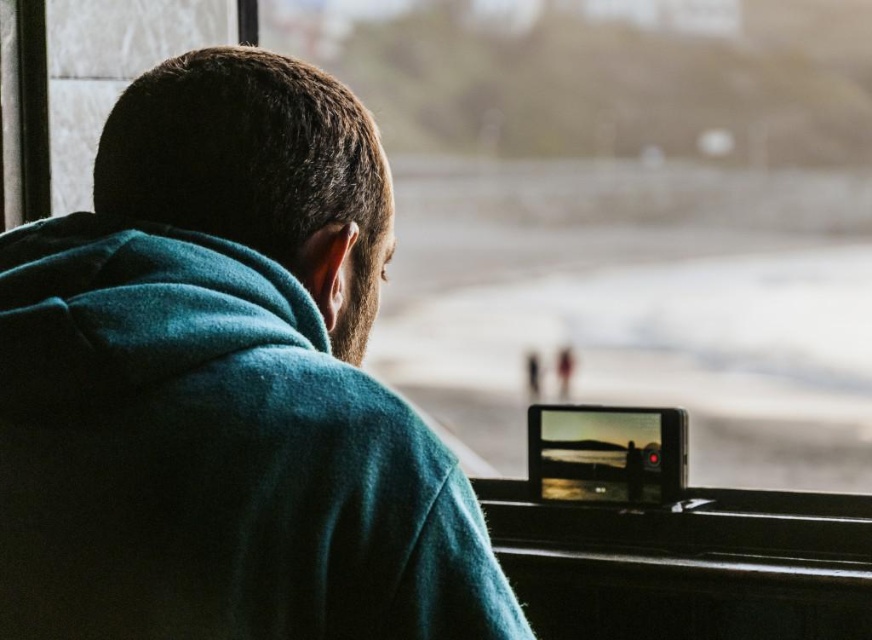
Does teal fleece jacket at upper left have a greater width compared to transparent glass train window at center?

No.

The height and width of the screenshot is (640, 872). I want to click on teal fleece jacket at upper left, so click(223, 387).

Does point (249, 580) come closer to viewer compared to point (461, 417)?

Yes.

The height and width of the screenshot is (640, 872). In order to click on teal fleece jacket at upper left in this screenshot , I will do `click(223, 387)`.